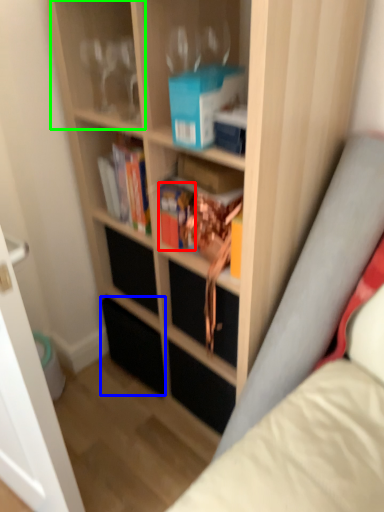
Question: Estimate the real-world distances between objects in this image. Which object is farther from book (highlighted by a red box), drawer (highlighted by a blue box) or shelf (highlighted by a green box)?

Choices:
 (A) drawer
 (B) shelf

Answer: (A)